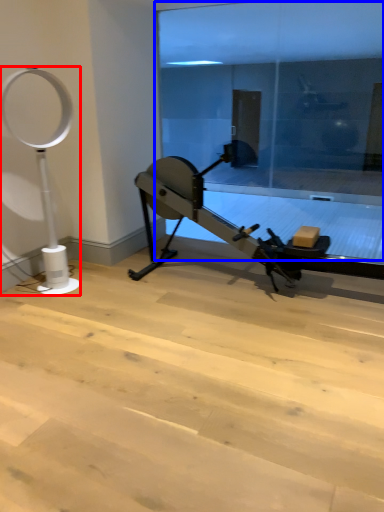
Question: Among these objects, which one is farthest to the camera, basketball hoop (highlighted by a red box) or glass door (highlighted by a blue box)?

Choices:
 (A) basketball hoop
 (B) glass door

Answer: (B)